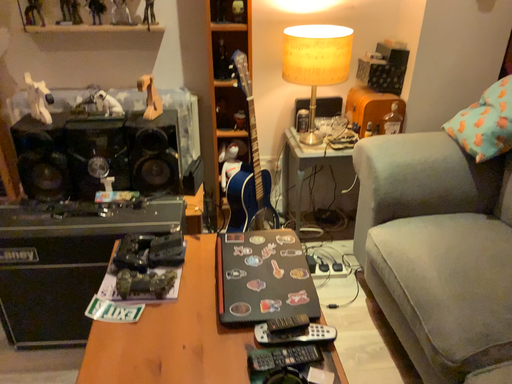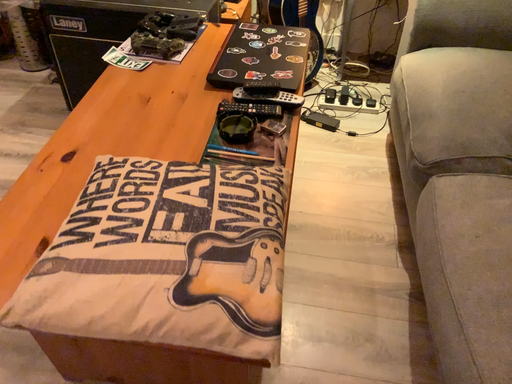
Question: How did the camera likely rotate when shooting the video?

Choices:
 (A) rotated left
 (B) rotated right

Answer: (A)